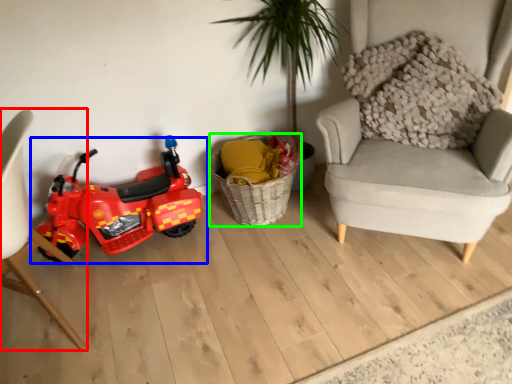
Question: Considering the real-world distances, which object is farthest from chair (highlighted by a red box)? land vehicle (highlighted by a blue box) or basket (highlighted by a green box)?

Choices:
 (A) land vehicle
 (B) basket

Answer: (B)